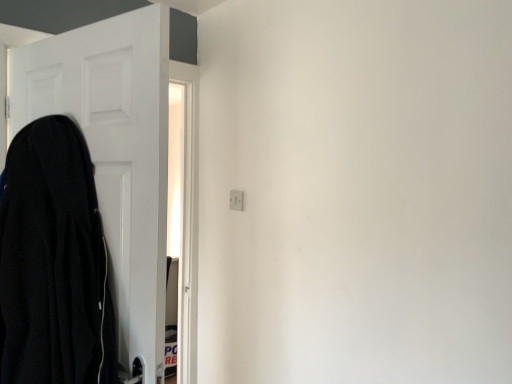
In order to face white matte door at left, should I rotate leftwards or rightwards?

You should look left and rotate roughly 22.784 degrees.

In order to click on white matte door at left in this screenshot , I will do click(x=115, y=152).

Considering the sizes of objects white matte door at left and white plastic electric outlet at upper center in the image provided, who is taller, white matte door at left or white plastic electric outlet at upper center?

white matte door at left is taller.

Looking at this image, which is more to the left, white matte door at left or white plastic electric outlet at upper center?

white matte door at left.

Is white matte door at left spatially inside white plastic electric outlet at upper center, or outside of it?

The correct answer is: outside.

From a real-world perspective, is white matte door at left under white plastic electric outlet at upper center?

Yes.

Are white plastic electric outlet at upper center and white matte door at left located far from each other?

No, white plastic electric outlet at upper center is not far from white matte door at left.

Is white plastic electric outlet at upper center at the right side of white matte door at left?

Yes.

Is white plastic electric outlet at upper center oriented towards white matte door at left?

Yes, white plastic electric outlet at upper center is oriented towards white matte door at left.

Is black matte coat at left far from white plastic electric outlet at upper center?

black matte coat at left is near white plastic electric outlet at upper center, not far away.

Does black matte coat at left have a greater width compared to white plastic electric outlet at upper center?

Correct, the width of black matte coat at left exceeds that of white plastic electric outlet at upper center.

Is black matte coat at left to the left or to the right of white plastic electric outlet at upper center in the image?

black matte coat at left is positioned on white plastic electric outlet at upper center's left side.

Based on the photo, from a real-world perspective, is black matte coat at left over white plastic electric outlet at upper center?

Incorrect, from a real-world perspective, black matte coat at left is lower than white plastic electric outlet at upper center.

Is white matte door at left in contact with black matte coat at left?

No, white matte door at left is not in contact with black matte coat at left.

Is black matte coat at left located within white matte door at left?

No, black matte coat at left is not a part of white matte door at left.

Does white matte door at left turn towards black matte coat at left?

Yes, white matte door at left is aimed at black matte coat at left.

From the picture: Considering the relative sizes of white plastic electric outlet at upper center and black matte coat at left in the image provided, is white plastic electric outlet at upper center shorter than black matte coat at left?

Indeed, white plastic electric outlet at upper center has a lesser height compared to black matte coat at left.

Is white plastic electric outlet at upper center facing away from black matte coat at left?

That's not correct — white plastic electric outlet at upper center is not looking away from black matte coat at left.

I want to click on electric outlet located above the black matte coat at left (from a real-world perspective), so click(x=236, y=200).

From a real-world perspective, between white plastic electric outlet at upper center and black matte coat at left, who is vertically lower?

black matte coat at left is physically lower.

Locate an element on the screen. door that is above the black matte coat at left (from a real-world perspective) is located at coordinates (115, 152).

Consider the image. Does black matte coat at left turn towards white matte door at left?

Yes, black matte coat at left is oriented towards white matte door at left.

In terms of height, does black matte coat at left look taller or shorter compared to white matte door at left?

In the image, black matte coat at left appears to be shorter than white matte door at left.

Is point (84, 200) farther from camera compared to point (138, 28)?

Yes.

Find the location of a particular element. The width and height of the screenshot is (512, 384). electric outlet lying above the white matte door at left (from the image's perspective) is located at coordinates (236, 200).

You are a GUI agent. You are given a task and a screenshot of the screen. Output one action in this format:
    pyautogui.click(x=<x>, y=<y>)
    Task: Click on the door below the white plastic electric outlet at upper center (from the image's perspective)
    
    Given the screenshot: What is the action you would take?
    pyautogui.click(x=115, y=152)

Estimate the real-world distances between objects in this image. Which object is closer to black matte coat at left, white plastic electric outlet at upper center or white matte door at left?

white matte door at left.

Based on the photo, based on their spatial positions, is white matte door at left or black matte coat at left further from white plastic electric outlet at upper center?

The object further to white plastic electric outlet at upper center is black matte coat at left.

Which object lies further to the anchor point white plastic electric outlet at upper center, black matte coat at left or white matte door at left?

The object further to white plastic electric outlet at upper center is black matte coat at left.

Which object lies nearer to the anchor point white matte door at left, black matte coat at left or white plastic electric outlet at upper center?

black matte coat at left is positioned closer to the anchor white matte door at left.

Which object lies further to the anchor point white matte door at left, white plastic electric outlet at upper center or black matte coat at left?

white plastic electric outlet at upper center is positioned further to the anchor white matte door at left.

Considering their positions, is white matte door at left positioned further to black matte coat at left than white plastic electric outlet at upper center?

The object further to black matte coat at left is white plastic electric outlet at upper center.

You are a GUI agent. You are given a task and a screenshot of the screen. Output one action in this format:
    pyautogui.click(x=<x>, y=<y>)
    Task: Click on the door between black matte coat at left and white plastic electric outlet at upper center from front to back
    
    Given the screenshot: What is the action you would take?
    pyautogui.click(x=115, y=152)